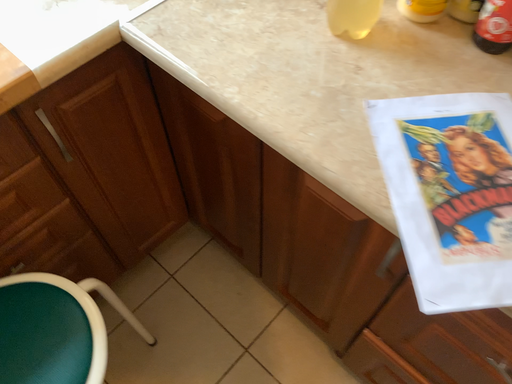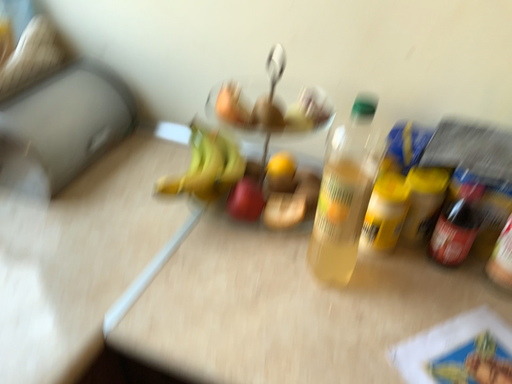
Question: Which way did the camera rotate in the video?

Choices:
 (A) rotated right
 (B) rotated left

Answer: (A)